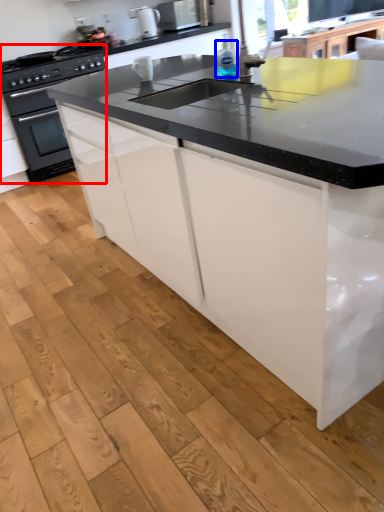
Question: Which object is closer to the camera taking this photo, home appliance (highlighted by a red box) or bottle (highlighted by a blue box)?

Choices:
 (A) home appliance
 (B) bottle

Answer: (B)